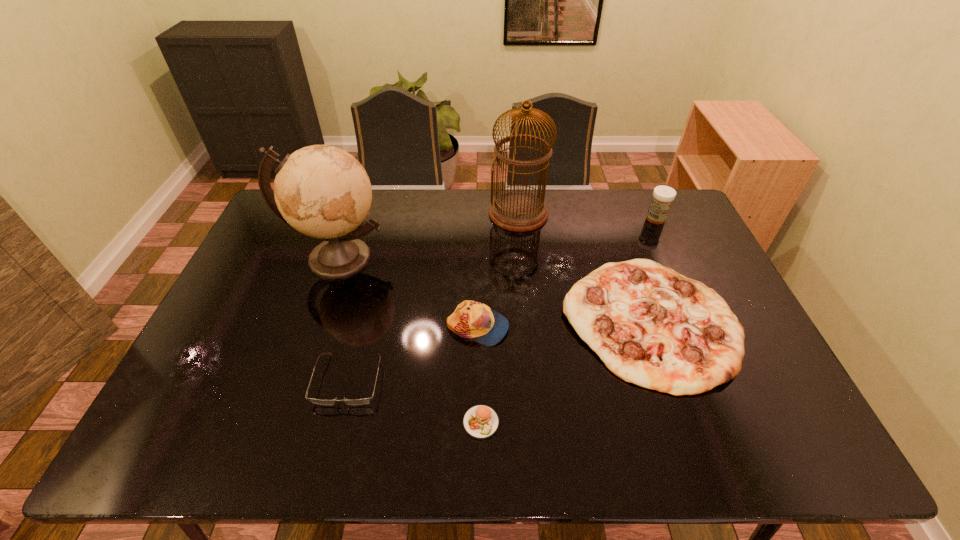
Locate an element on the screen. birdcage is located at coordinates (519, 211).

Find the location of a particular element. This screenshot has width=960, height=540. globe is located at coordinates (321, 191).

Locate an element on the screen. The image size is (960, 540). medicine is located at coordinates (663, 196).

In order to click on the fourth tallest object in this screenshot , I will do `click(471, 319)`.

This screenshot has height=540, width=960. Find the location of `the third shortest object`. the third shortest object is located at coordinates (651, 326).

You are a GUI agent. You are given a task and a screenshot of the screen. Output one action in this format:
    pyautogui.click(x=<x>, y=<y>)
    Task: Click on the second shortest object
    The width and height of the screenshot is (960, 540).
    Given the screenshot: What is the action you would take?
    pyautogui.click(x=364, y=401)

This screenshot has height=540, width=960. In order to click on the shortest object in this screenshot , I will do `click(481, 422)`.

Locate an element on the screen. This screenshot has height=540, width=960. vacant region located on the front-facing side of the birdcage is located at coordinates (523, 264).

I want to click on vacant space located on the front-facing side of the globe, so click(294, 390).

Identify the location of free location located on the front of the medicine. (665, 240).